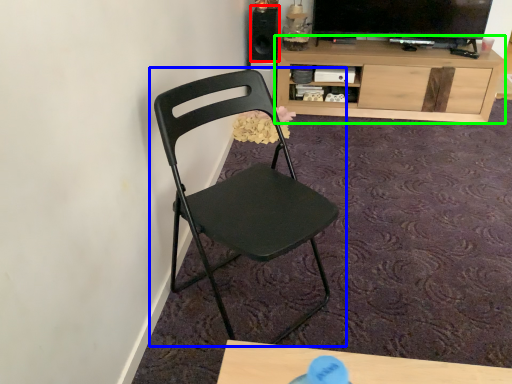
Question: Estimate the real-world distances between objects in this image. Which object is closer to speaker (highlighted by a red box), chair (highlighted by a blue box) or cabinetry (highlighted by a green box)?

Choices:
 (A) chair
 (B) cabinetry

Answer: (B)